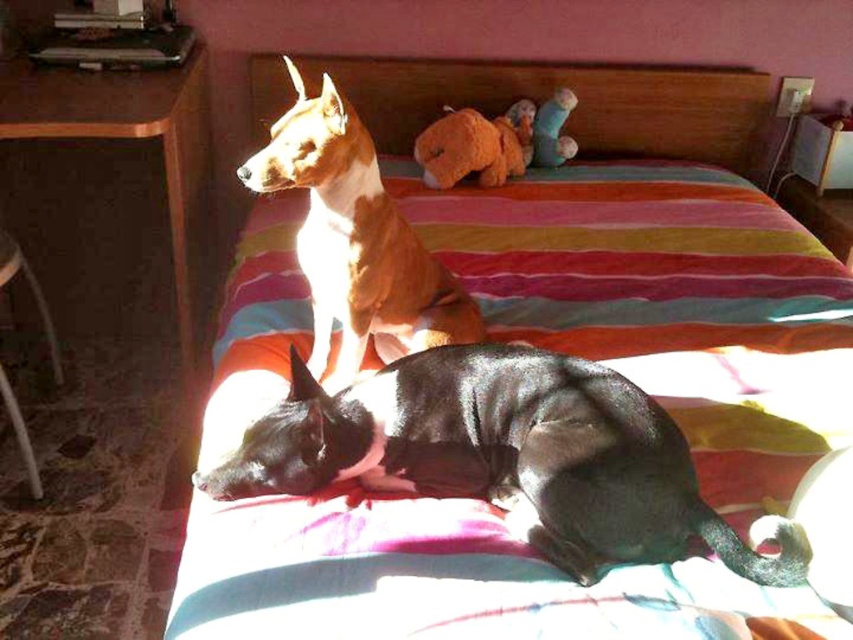
Question: Which of the following is the farthest from the observer?

Choices:
 (A) (461, 493)
 (B) (753, 496)

Answer: (A)

Question: Can you confirm if striped fabric bed at center is positioned above brown glossy dog at upper center?

Choices:
 (A) yes
 (B) no

Answer: (B)

Question: Is black smooth dog at center further to the viewer compared to brown glossy dog at upper center?

Choices:
 (A) no
 (B) yes

Answer: (A)

Question: Which object is positioned closest to the brown glossy dog at upper center?

Choices:
 (A) black smooth dog at center
 (B) striped fabric bed at center

Answer: (A)

Question: Can you confirm if striped fabric bed at center is positioned above black smooth dog at center?

Choices:
 (A) yes
 (B) no

Answer: (A)

Question: Which object is the farthest from the striped fabric bed at center?

Choices:
 (A) brown glossy dog at upper center
 (B) black smooth dog at center

Answer: (A)